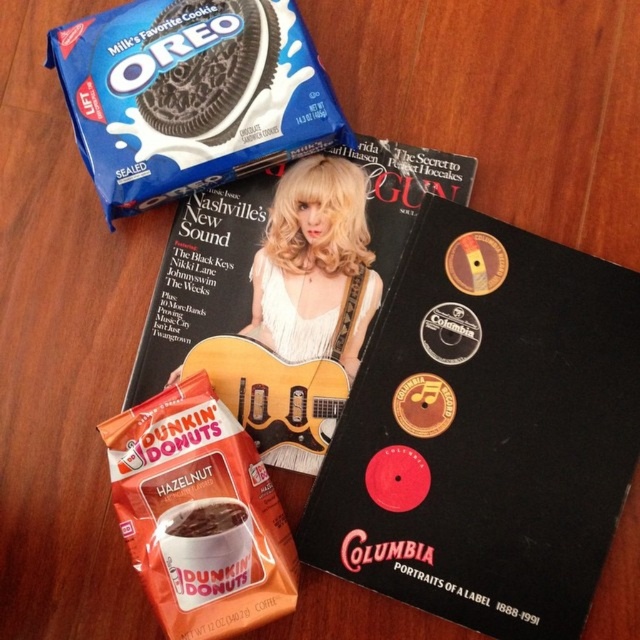
Question: Which of the following is the closest to the observer?

Choices:
 (A) blue matte oreo at upper left
 (B) orange matte dunkin' donuts hazelnut coffee at lower left

Answer: (B)

Question: Can you confirm if matte black magazine at upper center is positioned to the left of white matte dunkin donuts coffee at lower left?

Choices:
 (A) no
 (B) yes

Answer: (A)

Question: Is black matte book at upper center to the right of white matte dunkin donuts coffee at lower left from the viewer's perspective?

Choices:
 (A) no
 (B) yes

Answer: (B)

Question: Which object is farther from the camera taking this photo?

Choices:
 (A) blue matte oreo at upper left
 (B) white matte dunkin donuts coffee at lower left

Answer: (A)

Question: Can you confirm if blue matte oreo at upper left is positioned to the right of white matte dunkin donuts coffee at lower left?

Choices:
 (A) yes
 (B) no

Answer: (B)

Question: Which object is the farthest from the black matte book at upper center?

Choices:
 (A) white matte dunkin donuts coffee at lower left
 (B) orange matte dunkin' donuts hazelnut coffee at lower left

Answer: (A)